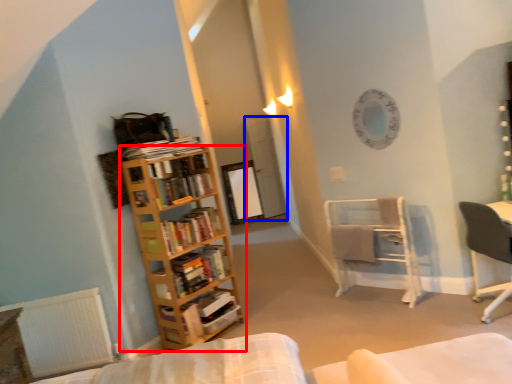
Question: Which point is further to the camera, bookcase (highlighted by a red box) or glass door (highlighted by a blue box)?

Choices:
 (A) bookcase
 (B) glass door

Answer: (B)